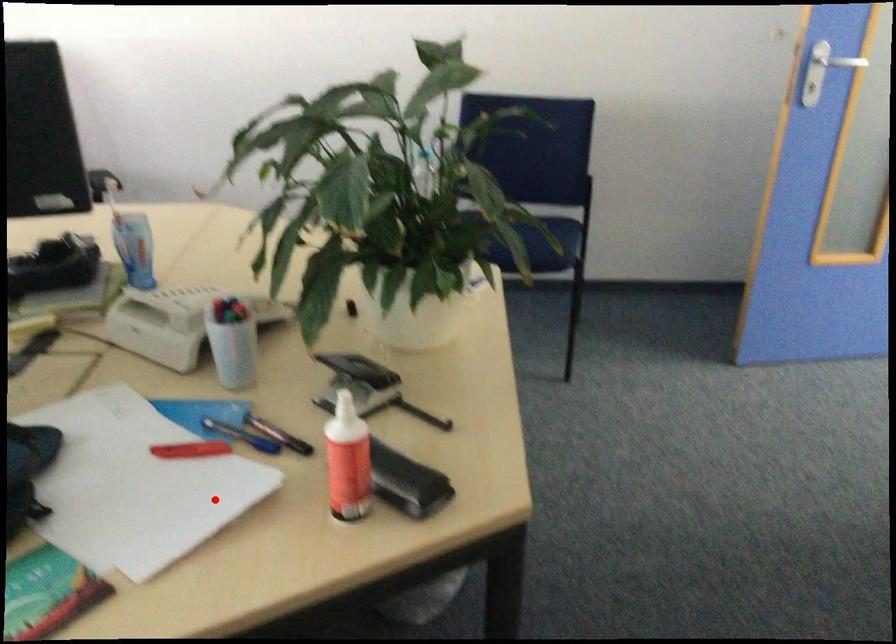
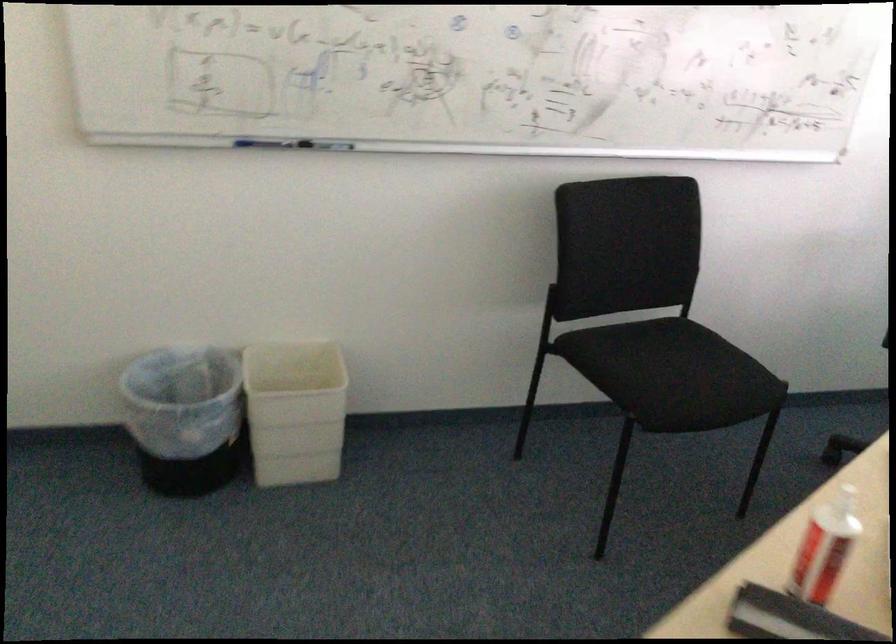
Question: I am providing you with two images of the same scene from different viewpoints. A red point is marked on the first image. Can you still see the location of the red point in image 2?

Choices:
 (A) Yes
 (B) No

Answer: (A)